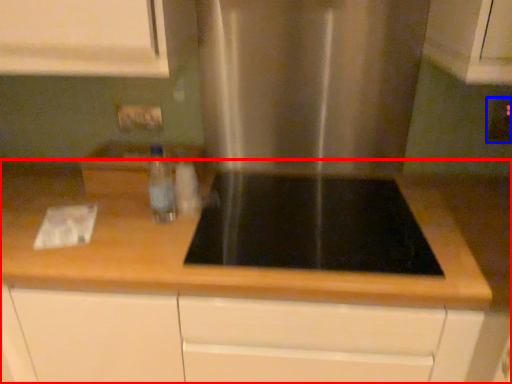
Question: Which point is further to the camera, countertop (highlighted by a red box) or electric outlet (highlighted by a blue box)?

Choices:
 (A) countertop
 (B) electric outlet

Answer: (B)